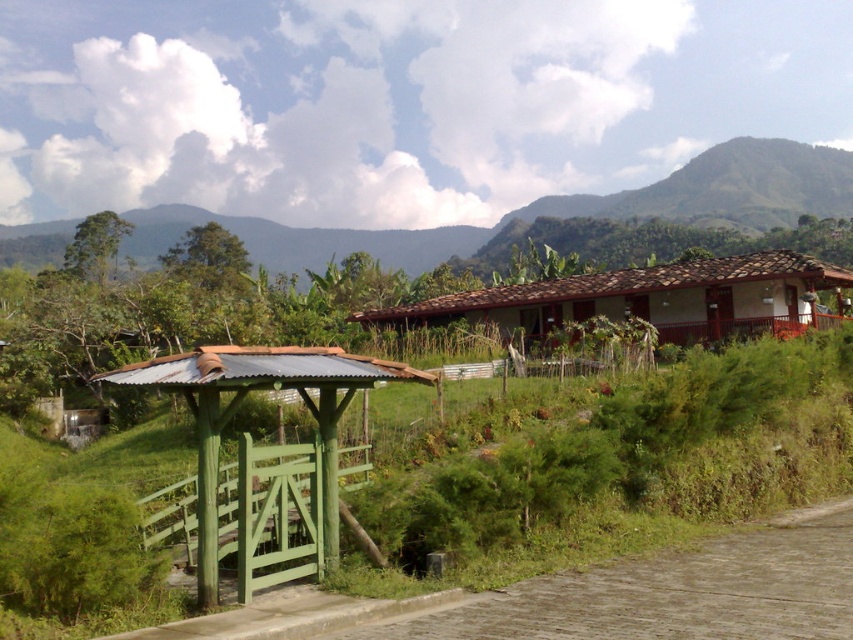
Who is taller, brown cobblestone path at lower right or brown clay roof hut at center?

brown clay roof hut at center is taller.

Where is `brown cobblestone path at lower right`? This screenshot has width=853, height=640. brown cobblestone path at lower right is located at coordinates (669, 593).

Find the location of a particular element. brown cobblestone path at lower right is located at coordinates (669, 593).

Is brown cobblestone path at lower right bigger than green wood/glass hut at lower left?

No, brown cobblestone path at lower right is not bigger than green wood/glass hut at lower left.

Does brown cobblestone path at lower right have a lesser width compared to green wood/glass hut at lower left?

Correct, brown cobblestone path at lower right's width is less than green wood/glass hut at lower left's.

Where is `brown cobblestone path at lower right`? brown cobblestone path at lower right is located at coordinates (669, 593).

This screenshot has height=640, width=853. I want to click on brown cobblestone path at lower right, so click(669, 593).

Is point (192, 497) closer to viewer compared to point (810, 301)?

Yes, point (192, 497) is in front of point (810, 301).

Is green wood/glass hut at lower left behind brown clay roof hut at center?

No, it is not.

At what (x,y) coordinates should I click in order to perform the action: click on green wood/glass hut at lower left. Please return your answer as a coordinate pair (x, y). Image resolution: width=853 pixels, height=640 pixels. Looking at the image, I should click on (260, 460).

Where is `green wood/glass hut at lower left`? The width and height of the screenshot is (853, 640). green wood/glass hut at lower left is located at coordinates (260, 460).